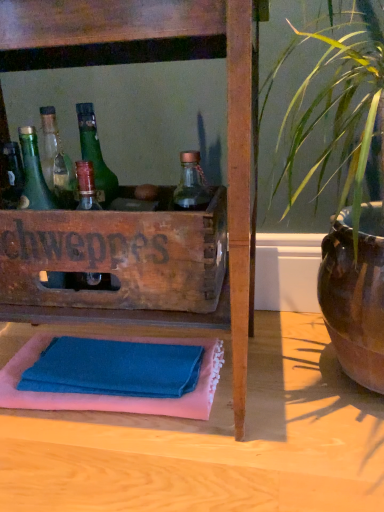
Locate an element on the screen. blue cotton bath towel at lower center is located at coordinates (114, 396).

From the image's perspective, who appears lower, blue cotton bath towel at lower center or green glass bottle at left?

blue cotton bath towel at lower center, from the image's perspective.

Is blue cotton bath towel at lower center oriented towards green glass bottle at left?

No, blue cotton bath towel at lower center is not turned towards green glass bottle at left.

In the image, is blue cotton bath towel at lower center positioned in front of or behind green glass bottle at left?

blue cotton bath towel at lower center is positioned farther from the viewer than green glass bottle at left.

Would you say blue cotton bath towel at lower center contains green glass bottle at left?

Definitely not — green glass bottle at left is not inside blue cotton bath towel at lower center.

Is green glass bottle at left facing away from wooden crate at center?

Yes.

From a real-world perspective, which object rests below the other?

From a 3D spatial view, wooden crate at center is below.

Where is `bottle on the left side of wooden crate at center`? Image resolution: width=384 pixels, height=512 pixels. bottle on the left side of wooden crate at center is located at coordinates (33, 175).

From the image's perspective, is green glass bottle at left under wooden crate at center?

Yes, from the image's perspective, green glass bottle at left is below wooden crate at center.

From the image's perspective, does green glass bottle at left appear lower than blue cotton bath towel at lower center?

No.

How different are the orientations of green glass bottle at left and blue cotton bath towel at lower center in degrees?

The angular difference between green glass bottle at left and blue cotton bath towel at lower center is 1.36 degrees.

Is point (48, 198) farther from camera compared to point (121, 404)?

Yes, point (48, 198) is farther from viewer.

From a real-world perspective, does green glass bottle at left stand above blue cotton bath towel at lower center?

Yes, from a real-world perspective, green glass bottle at left is on top of blue cotton bath towel at lower center.

Which point is more distant from viewer, (127,5) or (9,375)?

Positioned behind is point (9,375).

Based on the photo, who is smaller, wooden crate at center or blue cotton bath towel at lower center?

blue cotton bath towel at lower center.

How different are the orientations of wooden crate at center and blue cotton bath towel at lower center in degrees?

They differ by 1.7 degrees in their facing directions.

You are a GUI agent. You are given a task and a screenshot of the screen. Output one action in this format:
    pyautogui.click(x=<x>, y=<y>)
    Task: Click on the furniture above the blue cotton bath towel at lower center (from the image's perspective)
    This screenshot has width=384, height=512.
    Given the screenshot: What is the action you would take?
    pyautogui.click(x=157, y=61)

From the image's perspective, is wooden crate at center located above or below green glass bottle at left?

wooden crate at center is situated higher than green glass bottle at left in the image.

Considering the sizes of wooden crate at center and green glass bottle at left in the image, is wooden crate at center bigger or smaller than green glass bottle at left?

wooden crate at center is bigger than green glass bottle at left.

You are a GUI agent. You are given a task and a screenshot of the screen. Output one action in this format:
    pyautogui.click(x=<x>, y=<y>)
    Task: Click on the furniture on the right side of green glass bottle at left
    
    Given the screenshot: What is the action you would take?
    pyautogui.click(x=157, y=61)

From a real-world perspective, which object stands above the other?

In real-world perspective, green glass bottle at left is above.

Considering the relative sizes of blue cotton bath towel at lower center and wooden crate at center in the image provided, is blue cotton bath towel at lower center shorter than wooden crate at center?

Indeed, blue cotton bath towel at lower center has a lesser height compared to wooden crate at center.

Is blue cotton bath towel at lower center far from wooden crate at center?

They are positioned close to each other.

From a real-world perspective, which object stands above the other?

From a 3D spatial view, wooden crate at center is above.

In the image, is blue cotton bath towel at lower center positioned in front of or behind wooden crate at center?

In the image, blue cotton bath towel at lower center appears behind wooden crate at center.

At what (x,y) coordinates should I click in order to perform the action: click on bath towel below the green glass bottle at left (from a real-world perspective). Please return your answer as a coordinate pair (x, y). The width and height of the screenshot is (384, 512). Looking at the image, I should click on (114, 396).

You are a GUI agent. You are given a task and a screenshot of the screen. Output one action in this format:
    pyautogui.click(x=<x>, y=<y>)
    Task: Click on the bottle below the wooden crate at center (from the image's perspective)
    
    Given the screenshot: What is the action you would take?
    pyautogui.click(x=33, y=175)

Considering their positions, is green glass bottle at left positioned closer to blue cotton bath towel at lower center than wooden crate at center?

The object closer to blue cotton bath towel at lower center is green glass bottle at left.

Considering their positions, is wooden crate at center positioned closer to green glass bottle at left than blue cotton bath towel at lower center?

wooden crate at center is positioned closer to the anchor green glass bottle at left.

Considering their positions, is green glass bottle at left positioned further to wooden crate at center than blue cotton bath towel at lower center?

Among the two, blue cotton bath towel at lower center is located further to wooden crate at center.

Considering their positions, is blue cotton bath towel at lower center positioned closer to wooden crate at center than green glass bottle at left?

green glass bottle at left lies closer to wooden crate at center than the other object.

Considering their positions, is wooden crate at center positioned further to blue cotton bath towel at lower center than green glass bottle at left?

Based on the image, wooden crate at center appears to be further to blue cotton bath towel at lower center.

Based on their spatial positions, is blue cotton bath towel at lower center or wooden crate at center further from green glass bottle at left?

blue cotton bath towel at lower center is positioned further to the anchor green glass bottle at left.

Where is `bottle between wooden crate at center and blue cotton bath towel at lower center from top to bottom`? bottle between wooden crate at center and blue cotton bath towel at lower center from top to bottom is located at coordinates (33, 175).